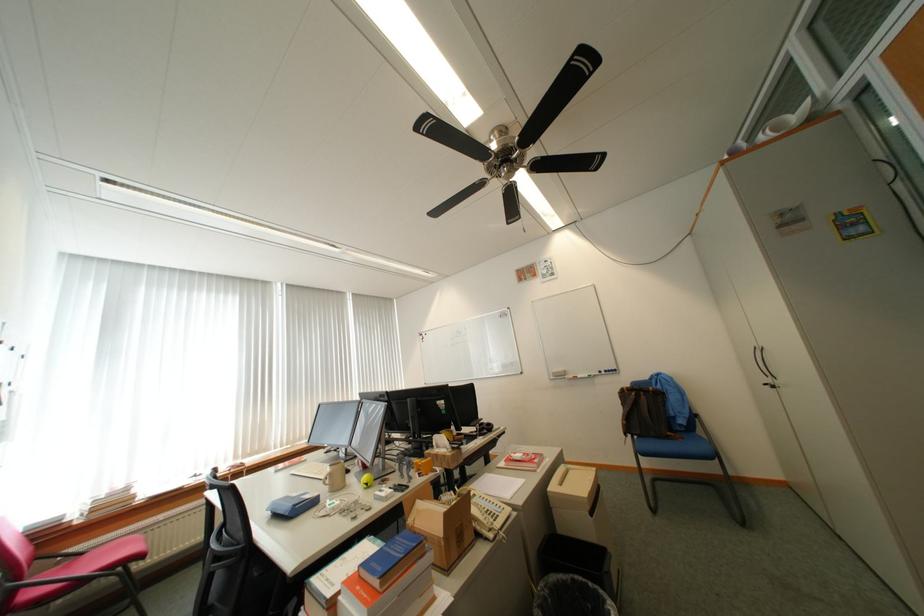
Identify the location of dark cabinet handle. (771, 378).